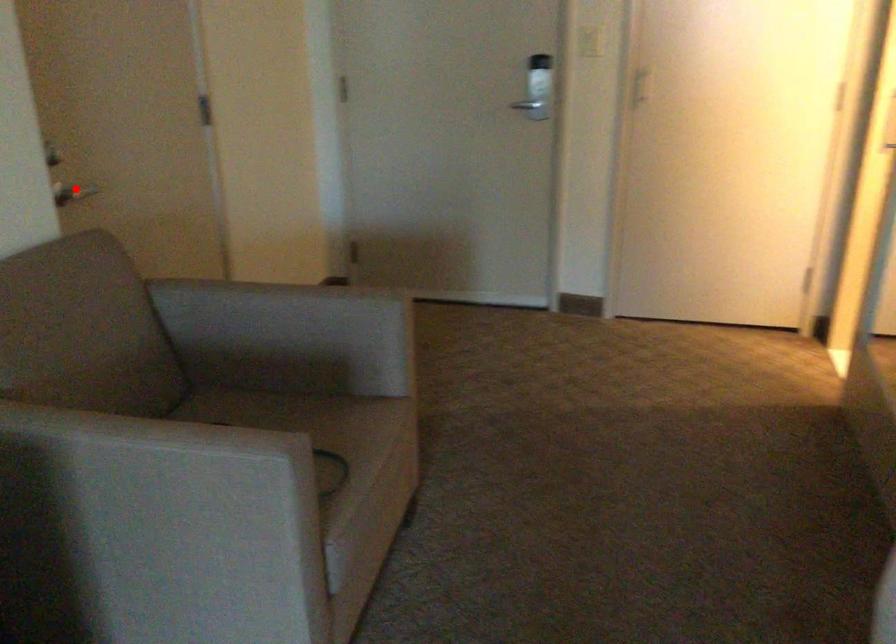
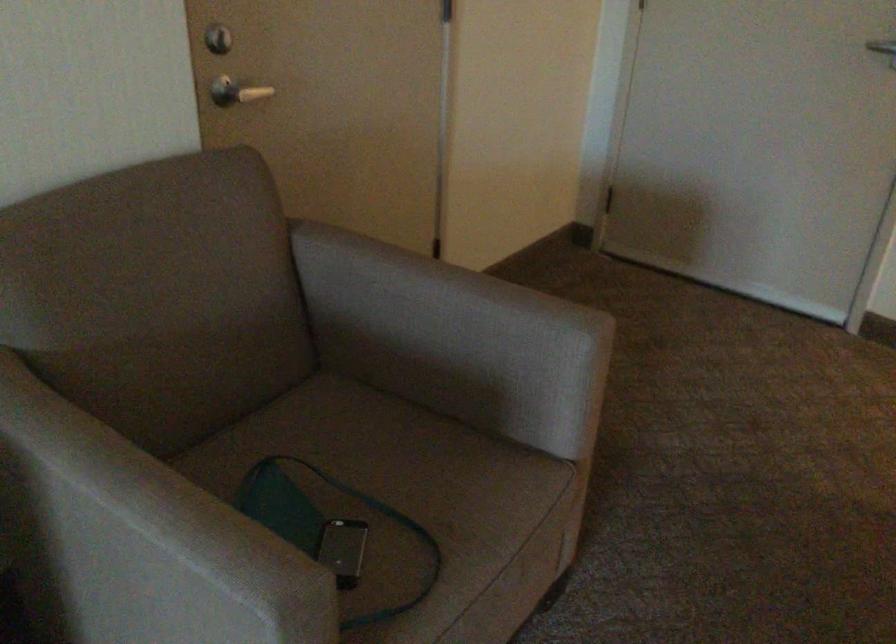
In the second image, find the point that corresponds to the highlighted location in the first image.

(236, 91)